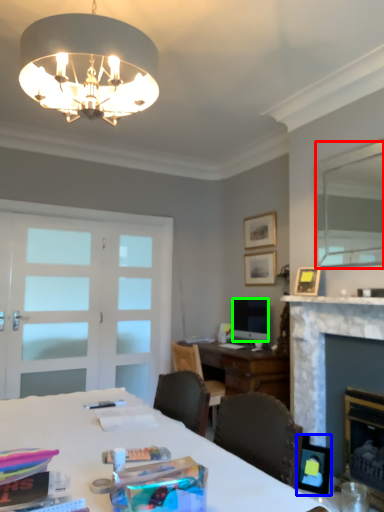
Question: Which object is positioned closest to mirror (highlighted by a red box)? Select from picture frame (highlighted by a blue box) and television (highlighted by a green box).

Choices:
 (A) picture frame
 (B) television

Answer: (B)